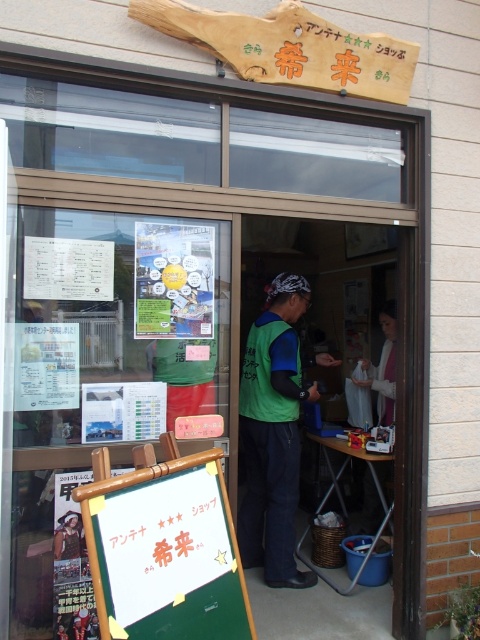
You are standing at the entrance of the shop and see two points marked on the glass doors. The first point is at coordinate (206,452) and the second is at (251,337). Which point is closer to you?

Point (206,452) is in front of point (251,337), so the first point is closer to you.

You are standing at the entrance of the shop and see two points marked on the glass door. The first point is at coordinates point (290, 371) and the second is at point (385, 376). Which point is closer to you?

Point (290, 371) is in front of point (385, 376), so the first point is closer to you.

From the picture: You are a customer entering the shop and notice the green chalkboard at lower left and the green fabric vest at center. Which object takes up more space in the entrance area?

The green fabric vest at center occupies more space than the green chalkboard at lower left.